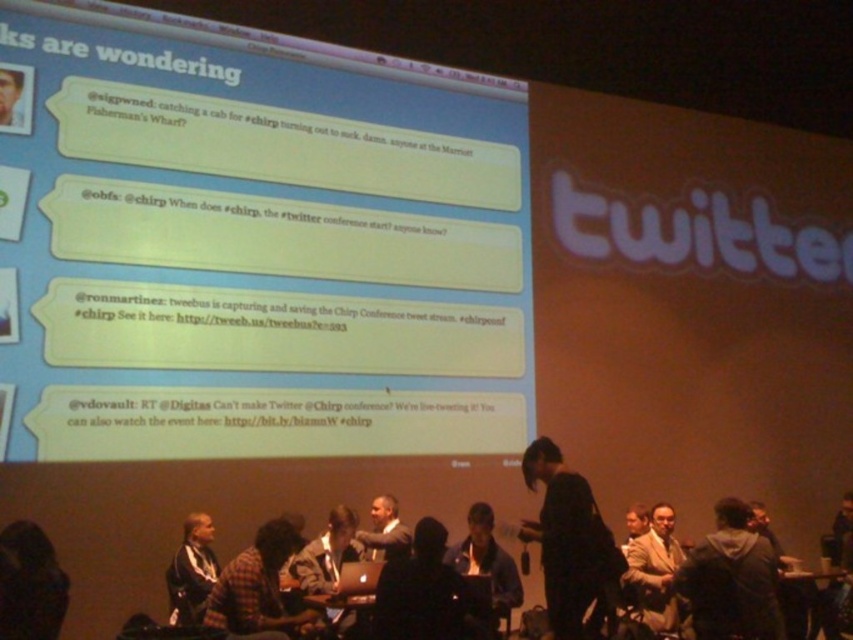
Question: Which is farther from the black matte dress at center?

Choices:
 (A) plaid shirt at center
 (B) dark brown leather jacket at center
 (C) dark fabric jacket at center

Answer: (A)

Question: Does matte plastic screen at upper left come behind plaid shirt at center?

Choices:
 (A) no
 (B) yes

Answer: (B)

Question: Among these objects, which one is nearest to the camera?

Choices:
 (A) light brown leather jacket at lower right
 (B) smooth skin face at upper left
 (C) plaid shirt at center

Answer: (C)

Question: Does dark gray fabric jacket at center lie behind smooth skin face at upper left?

Choices:
 (A) no
 (B) yes

Answer: (A)

Question: Which point appears farthest from the camera in this image?

Choices:
 (A) (59, 589)
 (B) (207, 570)
 (C) (437, 548)

Answer: (B)

Question: Does plaid shirt at center come in front of light brown leather jacket at lower right?

Choices:
 (A) yes
 (B) no

Answer: (A)